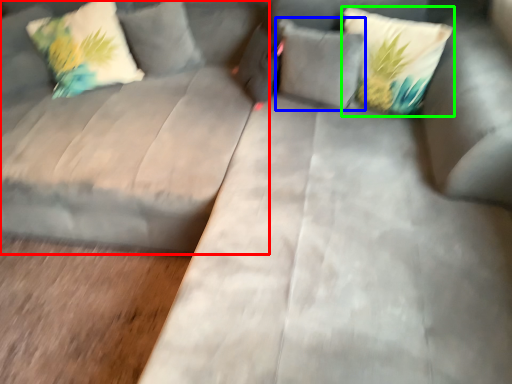
Question: Which object is the closest to the couch (highlighted by a red box)? Choose among these: pillow (highlighted by a blue box) or pillow (highlighted by a green box).

Choices:
 (A) pillow
 (B) pillow

Answer: (A)